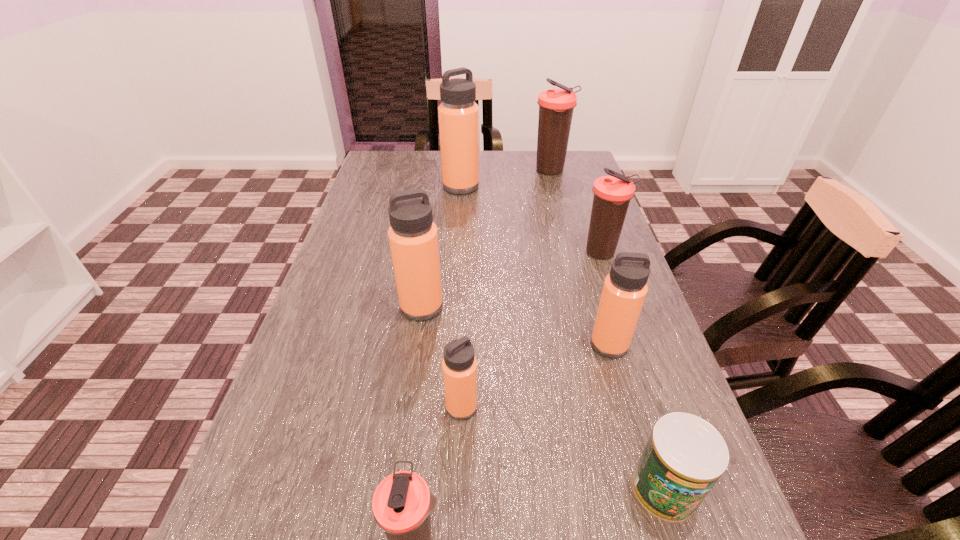
Image resolution: width=960 pixels, height=540 pixels. Find the location of `object present at the far right corner`. object present at the far right corner is located at coordinates (556, 106).

This screenshot has height=540, width=960. In order to click on free region at the far edge of the desktop in this screenshot , I will do `click(492, 154)`.

In the image, there is a desktop. Identify the location of vacant space at the left edge. (333, 253).

This screenshot has height=540, width=960. What are the coordinates of `vacant region at the right edge` in the screenshot? It's located at (618, 384).

Identify the location of free space between the third nearest thermos bottle and the smallest orange thermos bottle. (536, 376).

Locate an element on the screen. The width and height of the screenshot is (960, 540). vacant space that is in between the sixth farthest thermos bottle and the tallest thermos bottle is located at coordinates (461, 296).

This screenshot has height=540, width=960. I want to click on free space between the third farthest object and the nearest orange thermos bottle, so click(532, 330).

At what (x,y) coordinates should I click in order to perform the action: click on vacant region between the can and the third nearest orange thermos bottle. Please return your answer as a coordinate pair (x, y). Looking at the image, I should click on (543, 397).

Identify the location of free point between the shortest object and the fifth farthest thermos bottle. The width and height of the screenshot is (960, 540). (636, 416).

What are the coordinates of `empty space between the biggest brown thermos bottle and the tallest object` in the screenshot? It's located at point(506,179).